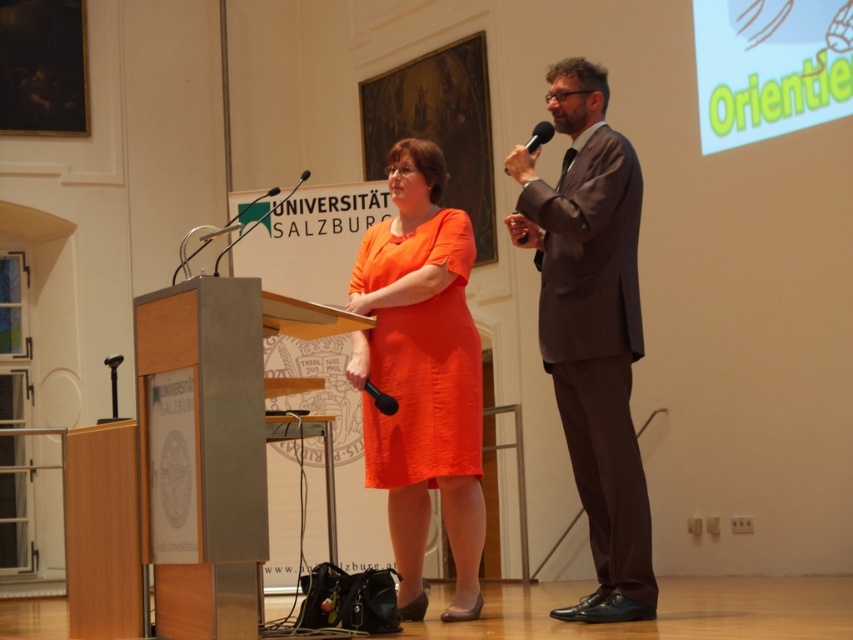
You are an attendee at the event and want to take a photo of the speaker without blocking the view of the orange satin dress at center. Where should you position yourself relative to the black plastic microphone at upper right?

The orange satin dress at center is located below the black plastic microphone at upper right. To avoid blocking the view, position yourself to the side or behind the black plastic microphone at upper right so that the microphone doesn not obstruct the view of the dress.

You are an event planner organizing a lecture at the Universitatsbibliothek Salzburg. You need to ensure that the orange satin dress at center worn by the speaker does not block the microphone stand on the metallic silver podium at center. Given their sizes, is the podium large enough to accommodate both the microphone stand and the dress without obstruction?

The metallic silver podium at center is bigger than orange satin dress at center, so yes, the podium is large enough to accommodate both the microphone stand and the dress without obstruction.